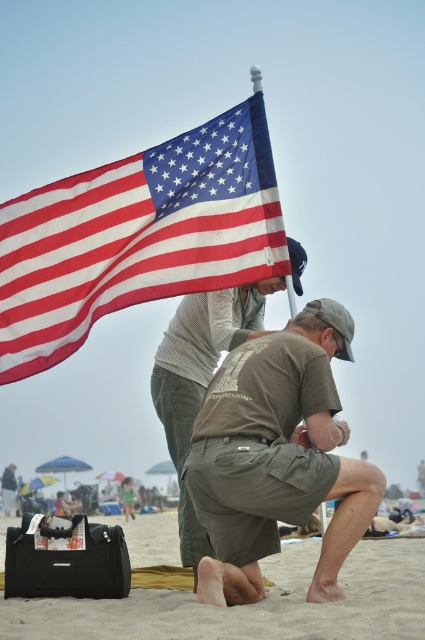
Which is below, american flag at upper left or sandy beige sand at lower center?

sandy beige sand at lower center is lower down.

Between american flag at upper left and sandy beige sand at lower center, which one appears on the left side from the viewer's perspective?

From the viewer's perspective, sandy beige sand at lower center appears more on the left side.

The height and width of the screenshot is (640, 425). Find the location of `american flag at upper left`. american flag at upper left is located at coordinates (138, 236).

Is american flag at upper left positioned behind khaki cotton shorts at center?

Yes.

Is american flag at upper left wider than khaki cotton shorts at center?

Correct, the width of american flag at upper left exceeds that of khaki cotton shorts at center.

Does point (254, 160) come farther from viewer compared to point (238, 381)?

Yes.

This screenshot has height=640, width=425. What are the coordinates of `american flag at upper left` in the screenshot? It's located at [138, 236].

Which of these two, khaki cotton shorts at center or sandy beige sand at lower center, stands taller?

Standing taller between the two is sandy beige sand at lower center.

Is khaki cotton shorts at center in front of sandy beige sand at lower center?

No, it is not.

The image size is (425, 640). What do you see at coordinates (278, 454) in the screenshot? I see `khaki cotton shorts at center` at bounding box center [278, 454].

Where is `khaki cotton shorts at center`? The height and width of the screenshot is (640, 425). khaki cotton shorts at center is located at coordinates (278, 454).